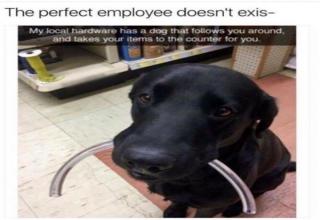
You are a GUI agent. You are given a task and a screenshot of the screen. Output one action in this format:
    pyautogui.click(x=<x>, y=<y>)
    Task: Click on the linoleum floor
    This screenshot has height=220, width=320.
    Given the screenshot: What is the action you would take?
    pyautogui.click(x=92, y=197), pyautogui.click(x=36, y=140), pyautogui.click(x=222, y=59), pyautogui.click(x=283, y=94), pyautogui.click(x=284, y=202), pyautogui.click(x=219, y=215), pyautogui.click(x=189, y=212)